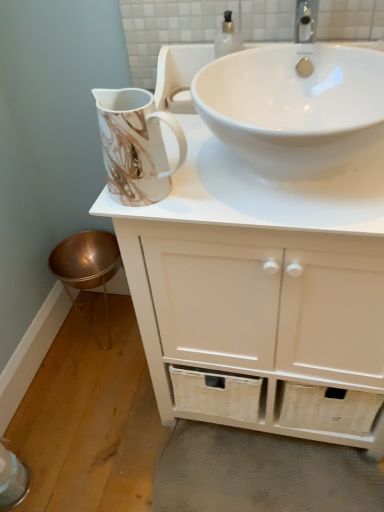
Question: Is marble-patterned ceramic jug at upper left taller than white matte cabinet at upper center?

Choices:
 (A) no
 (B) yes

Answer: (A)

Question: From the image's perspective, would you say marble-patterned ceramic jug at upper left is positioned over white matte cabinet at upper center?

Choices:
 (A) no
 (B) yes

Answer: (B)

Question: Could white matte cabinet at upper center be considered to be inside marble-patterned ceramic jug at upper left?

Choices:
 (A) yes
 (B) no

Answer: (B)

Question: Is marble-patterned ceramic jug at upper left at the right side of white matte cabinet at upper center?

Choices:
 (A) yes
 (B) no

Answer: (B)

Question: Can you confirm if marble-patterned ceramic jug at upper left is thinner than white matte cabinet at upper center?

Choices:
 (A) yes
 (B) no

Answer: (A)

Question: Considering their positions, is white matte cabinet at upper center located in front of or behind gray woven bath mat at lower center?

Choices:
 (A) behind
 (B) front

Answer: (B)

Question: Does point (190, 224) appear closer or farther from the camera than point (367, 490)?

Choices:
 (A) farther
 (B) closer

Answer: (B)

Question: Considering the positions of white matte cabinet at upper center and gray woven bath mat at lower center in the image, is white matte cabinet at upper center bigger or smaller than gray woven bath mat at lower center?

Choices:
 (A) small
 (B) big

Answer: (B)

Question: From the image's perspective, is white matte cabinet at upper center above or below gray woven bath mat at lower center?

Choices:
 (A) above
 (B) below

Answer: (A)

Question: Considering the positions of marble-patterned ceramic jug at upper left and gray woven bath mat at lower center in the image, is marble-patterned ceramic jug at upper left wider or thinner than gray woven bath mat at lower center?

Choices:
 (A) wide
 (B) thin

Answer: (B)

Question: From the image's perspective, is marble-patterned ceramic jug at upper left located above or below gray woven bath mat at lower center?

Choices:
 (A) above
 (B) below

Answer: (A)

Question: Is point (160, 116) positioned closer to the camera than point (342, 495)?

Choices:
 (A) closer
 (B) farther

Answer: (A)

Question: Considering the relative positions of marble-patterned ceramic jug at upper left and gray woven bath mat at lower center in the image provided, is marble-patterned ceramic jug at upper left to the left or to the right of gray woven bath mat at lower center?

Choices:
 (A) left
 (B) right

Answer: (A)

Question: Is white matte cabinet at upper center inside the boundaries of marble-patterned ceramic jug at upper left, or outside?

Choices:
 (A) inside
 (B) outside

Answer: (B)

Question: In the image, is white matte cabinet at upper center on the left side or the right side of marble-patterned ceramic jug at upper left?

Choices:
 (A) left
 (B) right

Answer: (B)